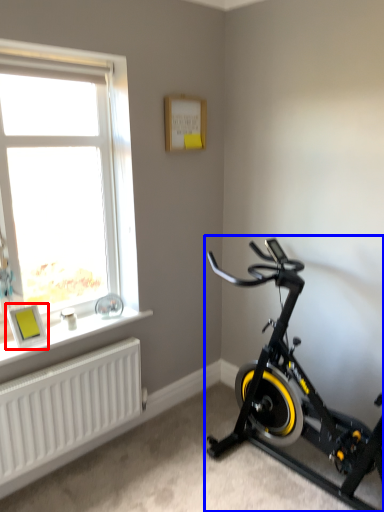
Question: Which of the following is the farthest to the observer, picture frame (highlighted by a red box) or stationary bicycle (highlighted by a blue box)?

Choices:
 (A) picture frame
 (B) stationary bicycle

Answer: (A)